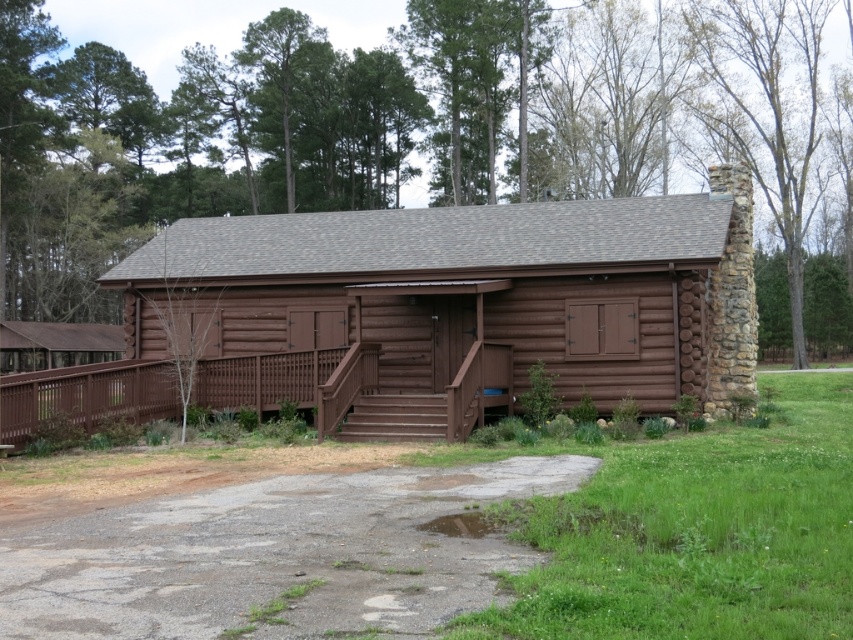
You are planning to park your car in the area shown in the image. You see the gray asphalt driveway at lower center and the brown wood porch at center. Which area is more suitable for parking your car?

The brown wood porch at center is more suitable for parking your car since it has a larger size compared to the gray asphalt driveway at lower center.

You are standing at point 0.5, 0.5 in the image. You want to walk to the brown log cabin at center. Which direction should you move in?

The brown log cabin at center is located at point (x=467, y=301). Since you are at (x=426, y=320), you should move slightly to the left and down to reach it.

You are planning to drive a delivery truck that is 2 meters wide to the brown log cabin at center. The truck needs to pass through the gray asphalt driveway at lower center. Based on the scene, can the truck safely pass through the driveway?

The brown log cabin at center might be wider than the gray asphalt driveway at lower center, so there is uncertainty about whether the driveway is wide enough for the 2 meter wide truck. Further measurements or confirmation would be needed to ensure safe passage.